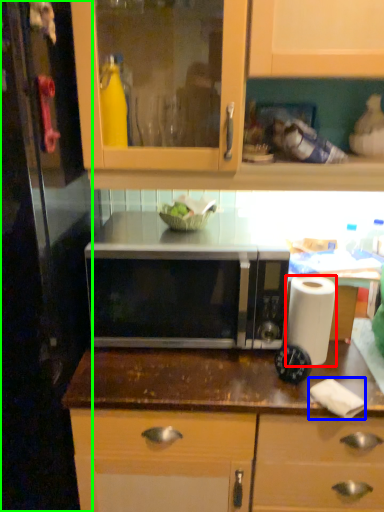
Question: Considering the real-world distances, which object is farthest from paper towel (highlighted by a red box)? toilet paper (highlighted by a blue box) or glass door (highlighted by a green box)?

Choices:
 (A) toilet paper
 (B) glass door

Answer: (B)